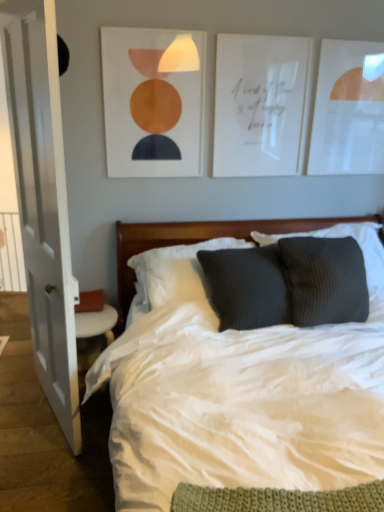
I want to click on dark gray ribbed pillow at center, the first pillow when ordered from right to left, so click(343, 237).

The width and height of the screenshot is (384, 512). Describe the element at coordinates (348, 110) in the screenshot. I see `white paper picture frame at upper right, the 3th picture frame when ordered from left to right` at that location.

The width and height of the screenshot is (384, 512). I want to click on white paper picture frame at upper right, the 3th picture frame when ordered from left to right, so click(348, 110).

The image size is (384, 512). What do you see at coordinates (122, 389) in the screenshot? I see `white soft bed at center` at bounding box center [122, 389].

Where is `ribbed dark gray pillow at center, which ranks as the first pillow in left-to-right order`? This screenshot has width=384, height=512. ribbed dark gray pillow at center, which ranks as the first pillow in left-to-right order is located at coordinates (175, 272).

Describe the element at coordinates (175, 272) in the screenshot. I see `ribbed dark gray pillow at center, which ranks as the first pillow in left-to-right order` at that location.

Measure the distance between point (11,81) and camera.

Point (11,81) and camera are 5.64 feet apart from each other.

Find the location of a particular element. The width and height of the screenshot is (384, 512). white paper picture frame at upper center, arranged as the second picture frame when viewed from the left is located at coordinates (260, 105).

Where is `wooden headboard at center`? The image size is (384, 512). wooden headboard at center is located at coordinates (199, 240).

Locate an element on the screen. This screenshot has width=384, height=512. dark gray ribbed pillow at center, which appears as the 2th pillow when viewed from the left is located at coordinates (343, 237).

Does point (171, 169) appear closer or farther from the camera than point (14, 218)?

Point (171, 169) is closer to the camera than point (14, 218).

Are matte orange circle at upper center, which is the third picture frame in right-to-left order, and white plastic radiator at left making contact?

No.

Is matte orange circle at upper center, arranged as the first picture frame when viewed from the left, not inside white plastic radiator at left?

Yes, matte orange circle at upper center, arranged as the first picture frame when viewed from the left, is outside of white plastic radiator at left.

Where is `picture frame positioned vertically above the matte orange circle at upper center, arranged as the first picture frame when viewed from the left (from a real-world perspective)`? This screenshot has height=512, width=384. picture frame positioned vertically above the matte orange circle at upper center, arranged as the first picture frame when viewed from the left (from a real-world perspective) is located at coordinates (348, 110).

Is white paper picture frame at upper right, the 3th picture frame when ordered from left to right, in front of or behind matte orange circle at upper center, which is the third picture frame in right-to-left order, in the image?

Visually, white paper picture frame at upper right, the 3th picture frame when ordered from left to right, is located behind matte orange circle at upper center, which is the third picture frame in right-to-left order.

Based on the photo, considering the sizes of white paper picture frame at upper right, the 3th picture frame when ordered from left to right, and matte orange circle at upper center, arranged as the first picture frame when viewed from the left, in the image, is white paper picture frame at upper right, the 3th picture frame when ordered from left to right, wider or thinner than matte orange circle at upper center, arranged as the first picture frame when viewed from the left,?

white paper picture frame at upper right, the 3th picture frame when ordered from left to right, is wider than matte orange circle at upper center, arranged as the first picture frame when viewed from the left.

Consider the image. Is there a large distance between white paper picture frame at upper right, the first picture frame positioned from the right, and matte orange circle at upper center, arranged as the first picture frame when viewed from the left?

No, white paper picture frame at upper right, the first picture frame positioned from the right, is in close proximity to matte orange circle at upper center, arranged as the first picture frame when viewed from the left.

In terms of width, does white plastic radiator at left look wider or thinner when compared to white paper picture frame at upper center, the 2th picture frame positioned from the right?

Considering their sizes, white plastic radiator at left looks broader than white paper picture frame at upper center, the 2th picture frame positioned from the right.

Does white plastic radiator at left have a larger size compared to white paper picture frame at upper center, arranged as the second picture frame when viewed from the left?

Incorrect, white plastic radiator at left is not larger than white paper picture frame at upper center, arranged as the second picture frame when viewed from the left.

Is white plastic radiator at left aimed at white paper picture frame at upper center, arranged as the second picture frame when viewed from the left?

No.

From a real-world perspective, does white plastic radiator at left sit lower than white paper picture frame at upper center, the 2th picture frame positioned from the right?

Yes.

From a real-world perspective, which object rests below the other?

In real-world perspective, white wood door at left is lower.

Does white wood door at left have a lesser height compared to white paper picture frame at upper right, the first picture frame positioned from the right?

In fact, white wood door at left may be taller than white paper picture frame at upper right, the first picture frame positioned from the right.

Considering the sizes of objects white wood door at left and white paper picture frame at upper right, the 3th picture frame when ordered from left to right, in the image provided, who is bigger, white wood door at left or white paper picture frame at upper right, the 3th picture frame when ordered from left to right,?

With larger size is white wood door at left.

Considering the sizes of objects white wood door at left and white paper picture frame at upper right, the first picture frame positioned from the right, in the image provided, who is thinner, white wood door at left or white paper picture frame at upper right, the first picture frame positioned from the right,?

Thinner between the two is white paper picture frame at upper right, the first picture frame positioned from the right.

Is dark gray ribbed pillow at center, which appears as the 2th pillow when viewed from the left, at the back of white soft bed at center?

Yes, dark gray ribbed pillow at center, which appears as the 2th pillow when viewed from the left, is at the back of white soft bed at center.

Measure the distance from white soft bed at center to dark gray ribbed pillow at center, the first pillow when ordered from right to left.

white soft bed at center is 88.45 centimeters from dark gray ribbed pillow at center, the first pillow when ordered from right to left.

Considering the sizes of objects white soft bed at center and dark gray ribbed pillow at center, the first pillow when ordered from right to left, in the image provided, who is taller, white soft bed at center or dark gray ribbed pillow at center, the first pillow when ordered from right to left,?

With more height is white soft bed at center.

Is white soft bed at center in contact with dark gray ribbed pillow at center, which appears as the 2th pillow when viewed from the left?

white soft bed at center and dark gray ribbed pillow at center, which appears as the 2th pillow when viewed from the left, are not in contact.

Locate an element on the screen. Image resolution: width=384 pixels, height=512 pixels. the 1st picture frame located above the dark gray ribbed pillow at center, which appears as the 2th pillow when viewed from the left (from a real-world perspective) is located at coordinates (260, 105).

Is dark gray ribbed pillow at center, which appears as the 2th pillow when viewed from the left, aimed at white paper picture frame at upper center, arranged as the second picture frame when viewed from the left?

No.

Is dark gray ribbed pillow at center, the first pillow when ordered from right to left, in contact with white paper picture frame at upper center, the 2th picture frame positioned from the right?

No, dark gray ribbed pillow at center, the first pillow when ordered from right to left, is not making contact with white paper picture frame at upper center, the 2th picture frame positioned from the right.

Is dark gray ribbed pillow at center, the first pillow when ordered from right to left, at the right side of ribbed dark gray pillow at center, which ranks as the first pillow in left-to-right order?

Yes.

From the image's perspective, between dark gray ribbed pillow at center, which appears as the 2th pillow when viewed from the left, and ribbed dark gray pillow at center, acting as the 2th pillow starting from the right, which one is located above?

From the image's view, dark gray ribbed pillow at center, which appears as the 2th pillow when viewed from the left, is above.

Which of these two, dark gray ribbed pillow at center, which appears as the 2th pillow when viewed from the left, or ribbed dark gray pillow at center, which ranks as the first pillow in left-to-right order, stands taller?

dark gray ribbed pillow at center, which appears as the 2th pillow when viewed from the left.

Is dark gray ribbed pillow at center, which appears as the 2th pillow when viewed from the left, turned away from ribbed dark gray pillow at center, which ranks as the first pillow in left-to-right order?

No, ribbed dark gray pillow at center, which ranks as the first pillow in left-to-right order, is not at the back of dark gray ribbed pillow at center, which appears as the 2th pillow when viewed from the left.

You are a GUI agent. You are given a task and a screenshot of the screen. Output one action in this format:
    pyautogui.click(x=<x>, y=<y>)
    Task: Click on the balustrade behind the matte orange circle at upper center, which is the third picture frame in right-to-left order
    
    Given the screenshot: What is the action you would take?
    pyautogui.click(x=12, y=254)

There is a matte orange circle at upper center, which is the third picture frame in right-to-left order. Identify the location of picture frame above it (from a real-world perspective). (348, 110).

From the image, which object appears to be farther from wooden headboard at center, ribbed dark gray pillow at center, acting as the 2th pillow starting from the right, or white wood door at left?

white wood door at left.

In the scene shown: Considering their positions, is wooden headboard at center positioned further to white wood door at left than matte orange circle at upper center, arranged as the first picture frame when viewed from the left?

The object further to white wood door at left is wooden headboard at center.

From the picture: Based on their spatial positions, is dark gray ribbed pillow at center, the first pillow when ordered from right to left, or white paper picture frame at upper center, the 2th picture frame positioned from the right, further from ribbed dark gray pillow at center, acting as the 2th pillow starting from the right?

white paper picture frame at upper center, the 2th picture frame positioned from the right.

When comparing their distances from white plastic radiator at left, does ribbed dark gray pillow at center, acting as the 2th pillow starting from the right, or white paper picture frame at upper right, the first picture frame positioned from the right, seem closer?

Based on the image, ribbed dark gray pillow at center, acting as the 2th pillow starting from the right, appears to be nearer to white plastic radiator at left.

Considering their positions, is dark gray ribbed pillow at center, the first pillow when ordered from right to left, positioned further to white paper picture frame at upper center, arranged as the second picture frame when viewed from the left, than white wood door at left?

white wood door at left is positioned further to the anchor white paper picture frame at upper center, arranged as the second picture frame when viewed from the left.

Estimate the real-world distances between objects in this image. Which object is further from white plastic radiator at left, dark gray ribbed pillow at center, the first pillow when ordered from right to left, or white paper picture frame at upper center, the 2th picture frame positioned from the right?

The object further to white plastic radiator at left is dark gray ribbed pillow at center, the first pillow when ordered from right to left.

Which object lies nearer to the anchor point white paper picture frame at upper right, the 3th picture frame when ordered from left to right, white soft bed at center or ribbed dark gray pillow at center, which ranks as the first pillow in left-to-right order?

ribbed dark gray pillow at center, which ranks as the first pillow in left-to-right order, lies closer to white paper picture frame at upper right, the 3th picture frame when ordered from left to right, than the other object.

Which object lies further to the anchor point matte orange circle at upper center, which is the third picture frame in right-to-left order, dark gray ribbed pillow at center, the first pillow when ordered from right to left, or white soft bed at center?

The object further to matte orange circle at upper center, which is the third picture frame in right-to-left order, is white soft bed at center.

Image resolution: width=384 pixels, height=512 pixels. Identify the location of pillow between white wood door at left and dark gray ribbed pillow at center, the first pillow when ordered from right to left. (175, 272).

The height and width of the screenshot is (512, 384). I want to click on picture frame between white soft bed at center and white paper picture frame at upper center, the 2th picture frame positioned from the right, from front to back, so click(153, 101).

Identify the location of headboard situated between white wood door at left and dark gray ribbed pillow at center, which appears as the 2th pillow when viewed from the left, from left to right. The height and width of the screenshot is (512, 384). (199, 240).

This screenshot has width=384, height=512. In order to click on pillow between white paper picture frame at upper center, arranged as the second picture frame when viewed from the left, and wooden headboard at center, in the vertical direction in this screenshot , I will do `click(343, 237)`.